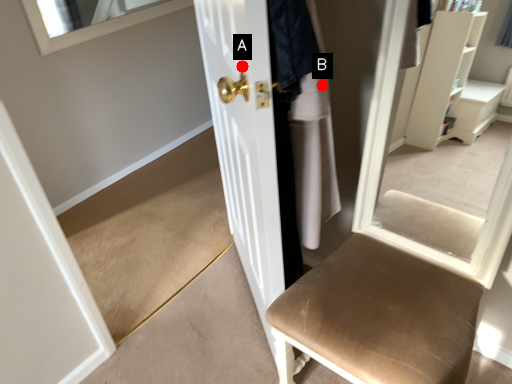
Question: Two points are circled on the image, labeled by A and B beside each circle. Which point is closer to the camera?

Choices:
 (A) A is closer
 (B) B is closer

Answer: (B)